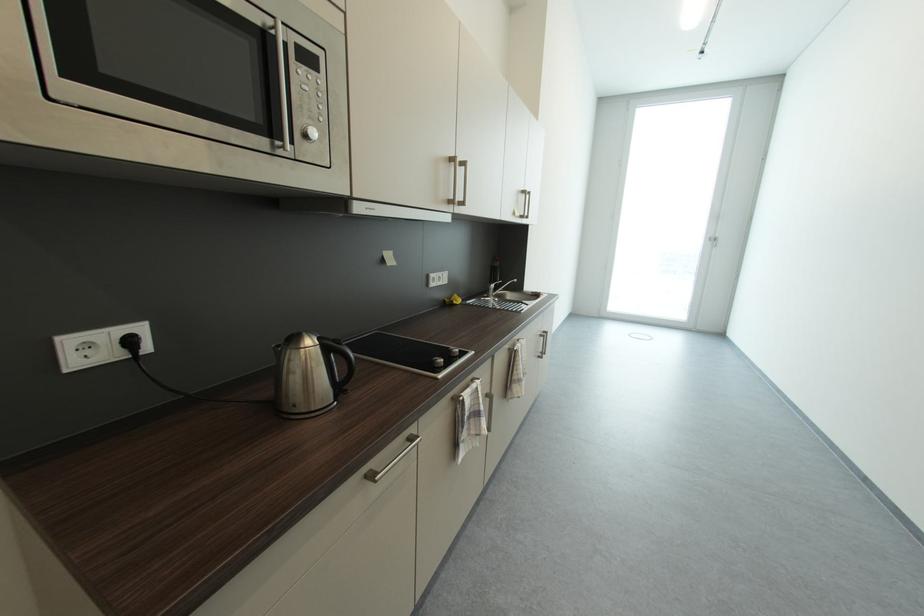
Find where to lift the faucet handle. Please return your answer as a coordinate pair (x, y).

(496, 286)